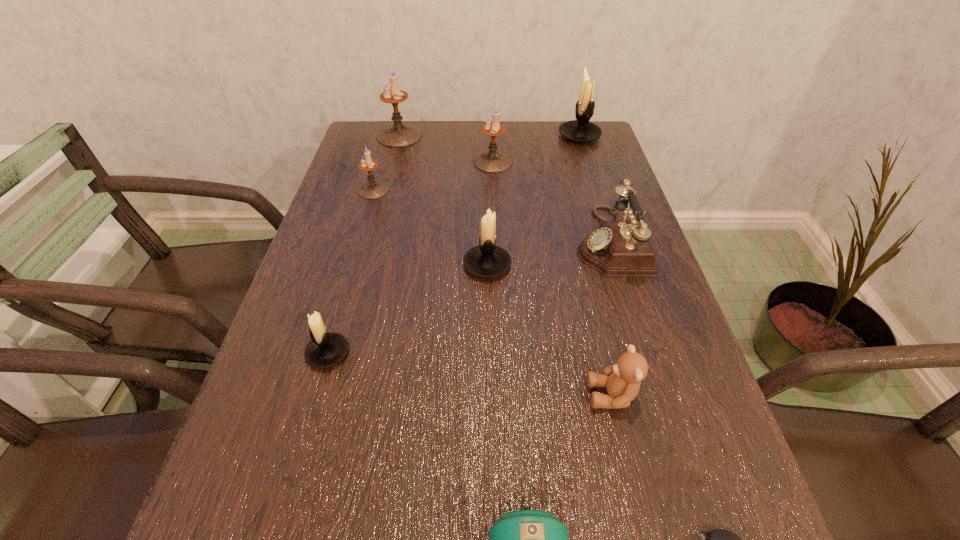
Where is `object at the far right corner`? The image size is (960, 540). object at the far right corner is located at coordinates (581, 130).

You are a GUI agent. You are given a task and a screenshot of the screen. Output one action in this format:
    pyautogui.click(x=<x>, y=<y>)
    Task: Click on the vacant space at the far edge of the desktop
    The width and height of the screenshot is (960, 540).
    Given the screenshot: What is the action you would take?
    pyautogui.click(x=551, y=147)

Locate an element on the screen. Image resolution: width=960 pixels, height=540 pixels. vacant point at the left edge is located at coordinates (294, 315).

Identify the location of free spot at the right edge of the desktop. This screenshot has width=960, height=540. (602, 286).

This screenshot has width=960, height=540. In order to click on free space between the fifth farthest candle holder and the nearest candle holder in this screenshot , I will do `click(408, 309)`.

You are a GUI agent. You are given a task and a screenshot of the screen. Output one action in this format:
    pyautogui.click(x=<x>, y=<y>)
    Task: Click on the free space between the black telephone and the second farthest white candle holder
    The height and width of the screenshot is (540, 960).
    Given the screenshot: What is the action you would take?
    pyautogui.click(x=548, y=253)

The width and height of the screenshot is (960, 540). Identify the location of unoccupied area between the smallest white candle holder and the second nearest white candle holder. (408, 309).

Image resolution: width=960 pixels, height=540 pixels. What are the coordinates of `free space between the second farthest white candle holder and the eighth farthest object` in the screenshot? It's located at (549, 330).

The image size is (960, 540). Identify the location of vacant area between the second farthest purple candle holder and the seventh nearest object. (433, 176).

Identify the location of blank region between the farthest purple candle holder and the smallest purple candle holder. (386, 163).